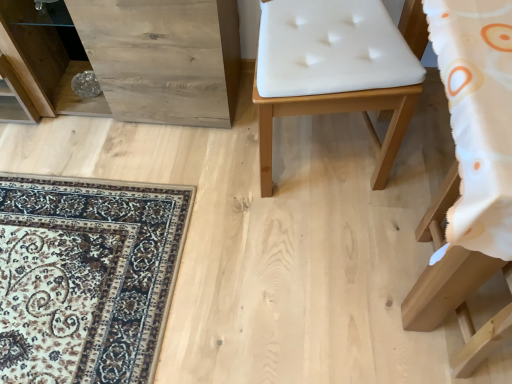
Question: Are white leather chair at center, acting as the 2th furniture starting from the right, and white fabric cushion at lower right, which is the 1th furniture in bottom-to-top order, located far from each other?

Choices:
 (A) no
 (B) yes

Answer: (A)

Question: Can you confirm if white leather chair at center, which is counted as the first furniture, starting from the top, is shorter than white fabric cushion at lower right, acting as the second furniture starting from the top?

Choices:
 (A) no
 (B) yes

Answer: (A)

Question: Is the depth of white leather chair at center, which is counted as the first furniture, starting from the top, greater than that of white fabric cushion at lower right, which appears as the second furniture when viewed from the left?

Choices:
 (A) yes
 (B) no

Answer: (A)

Question: Is white leather chair at center, marked as the first furniture in a left-to-right arrangement, surrounding white fabric cushion at lower right, which is the first furniture in right-to-left order?

Choices:
 (A) no
 (B) yes

Answer: (A)

Question: Does white leather chair at center, which is counted as the first furniture, starting from the top, have a greater width compared to white fabric cushion at lower right, which appears as the second furniture when viewed from the left?

Choices:
 (A) no
 (B) yes

Answer: (A)

Question: Is white fabric cushion at lower right, which appears as the second furniture when viewed from the left, situated inside white leather chair at center, which is counted as the first furniture, starting from the top, or outside?

Choices:
 (A) outside
 (B) inside

Answer: (A)

Question: Considering the positions of white fabric cushion at lower right, which is the 1th furniture in bottom-to-top order, and white leather chair at center, which is counted as the first furniture, starting from the top, in the image, is white fabric cushion at lower right, which is the 1th furniture in bottom-to-top order, wider or thinner than white leather chair at center, which is counted as the first furniture, starting from the top,?

Choices:
 (A) wide
 (B) thin

Answer: (A)

Question: Based on their sizes in the image, would you say white fabric cushion at lower right, acting as the second furniture starting from the top, is bigger or smaller than white leather chair at center, which is the 2th furniture from bottom to top?

Choices:
 (A) small
 (B) big

Answer: (A)

Question: Relative to white leather chair at center, acting as the 2th furniture starting from the right, is white fabric cushion at lower right, which is the 1th furniture in bottom-to-top order, in front or behind?

Choices:
 (A) behind
 (B) front

Answer: (B)

Question: Is white fabric cushion at lower right, which is the 1th furniture in bottom-to-top order, to the left or to the right of natural wood dresser at left in the image?

Choices:
 (A) left
 (B) right

Answer: (B)

Question: Is white fabric cushion at lower right, which is the 1th furniture in bottom-to-top order, inside the boundaries of natural wood dresser at left, or outside?

Choices:
 (A) outside
 (B) inside

Answer: (A)

Question: From a real-world perspective, is white fabric cushion at lower right, acting as the second furniture starting from the top, above or below natural wood dresser at left?

Choices:
 (A) above
 (B) below

Answer: (B)

Question: Is white fabric cushion at lower right, which appears as the second furniture when viewed from the left, in front of or behind natural wood dresser at left in the image?

Choices:
 (A) front
 (B) behind

Answer: (A)

Question: Based on their sizes in the image, would you say natural wood dresser at left is bigger or smaller than white leather chair at center, acting as the 2th furniture starting from the right?

Choices:
 (A) big
 (B) small

Answer: (A)

Question: Would you say natural wood dresser at left is to the left or to the right of white leather chair at center, marked as the first furniture in a left-to-right arrangement, in the picture?

Choices:
 (A) right
 (B) left

Answer: (B)